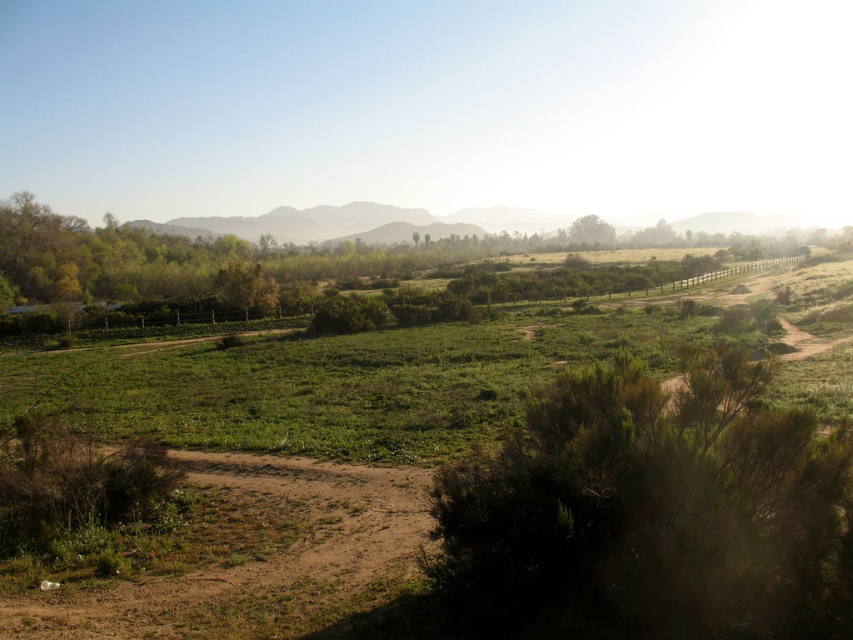
You are standing on the dirt path and want to walk to the green grassy hillside at center. Which direction should you walk to avoid the dark green bush at lower right?

You should walk towards the center to reach the green grassy hillside at center while avoiding the dark green bush at lower right, which is closer to you on the lower right side.

You are a hiker standing at the start of the dirt path in the foreground. You want to climb the highest point visible in the scene. Which object should you head towards, the green grassy hillside at center or the brown textured tree at center?

The green grassy hillside at center has a greater height compared to the brown textured tree at center, so you should head towards the green grassy hillside at center to reach the highest point.